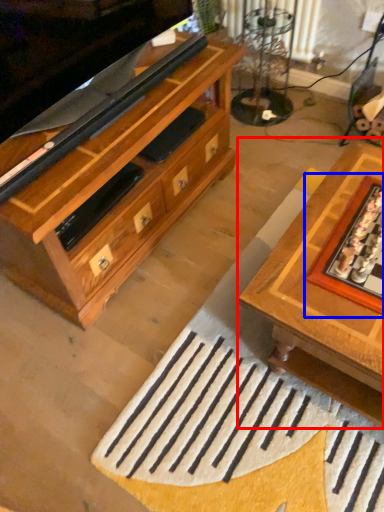
Question: Which object appears closest to the camera in this image, table (highlighted by a red box) or board game (highlighted by a blue box)?

Choices:
 (A) table
 (B) board game

Answer: (A)